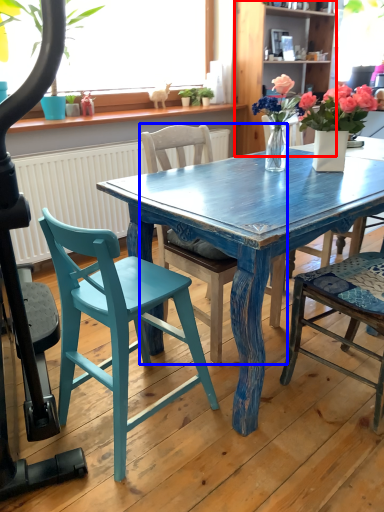
Question: Which object is closer to the camera taking this photo, bookshelf (highlighted by a red box) or chair (highlighted by a blue box)?

Choices:
 (A) bookshelf
 (B) chair

Answer: (B)